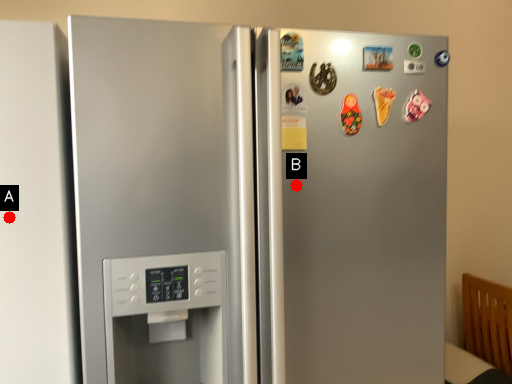
Question: Two points are circled on the image, labeled by A and B beside each circle. Which point appears closest to the camera in this image?

Choices:
 (A) A is closer
 (B) B is closer

Answer: (A)